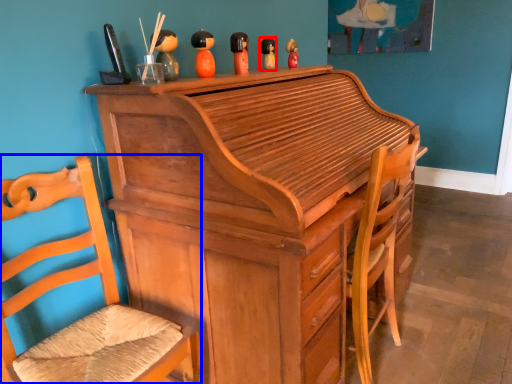
Question: Among these objects, which one is nearest to the camera, toy (highlighted by a red box) or chair (highlighted by a blue box)?

Choices:
 (A) toy
 (B) chair

Answer: (B)